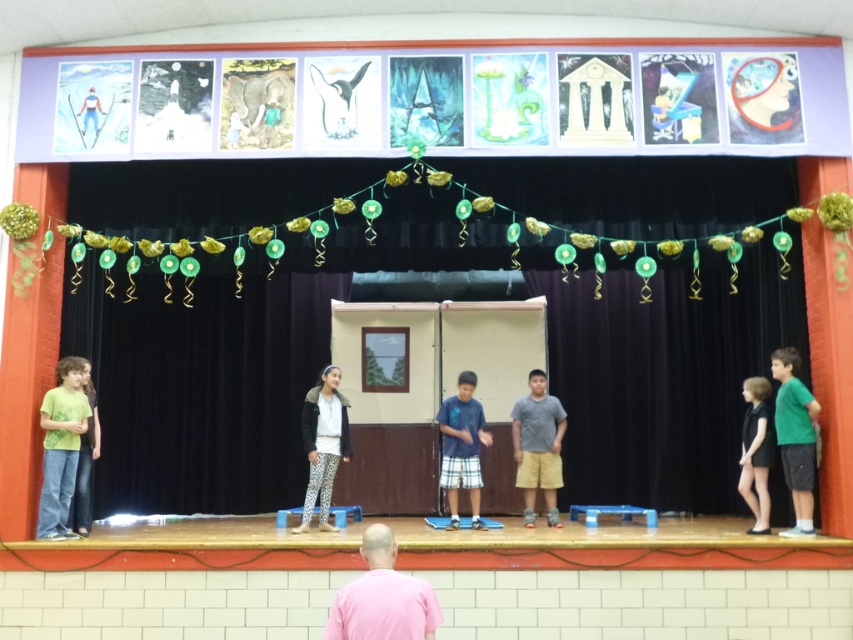
Question: Which of the following is the farthest from the observer?

Choices:
 (A) blue cotton shirt at center
 (B) black fabric curtain at center
 (C) green matte shirt at left

Answer: (A)

Question: Which point appears closest to the camera in this image?

Choices:
 (A) (57, 509)
 (B) (554, 417)

Answer: (A)

Question: Does gray cotton shirt at center appear on the right side of green matte pants at left?

Choices:
 (A) yes
 (B) no

Answer: (A)

Question: Among these points, which one is farthest from the camera?

Choices:
 (A) (442, 298)
 (B) (804, 436)

Answer: (A)

Question: Can you confirm if white fleece jacket at center is positioned below blue cotton shirt at center?

Choices:
 (A) no
 (B) yes

Answer: (A)

Question: From the image, what is the correct spatial relationship of white fleece jacket at center in relation to blue cotton shirt at center?

Choices:
 (A) above
 (B) below

Answer: (A)